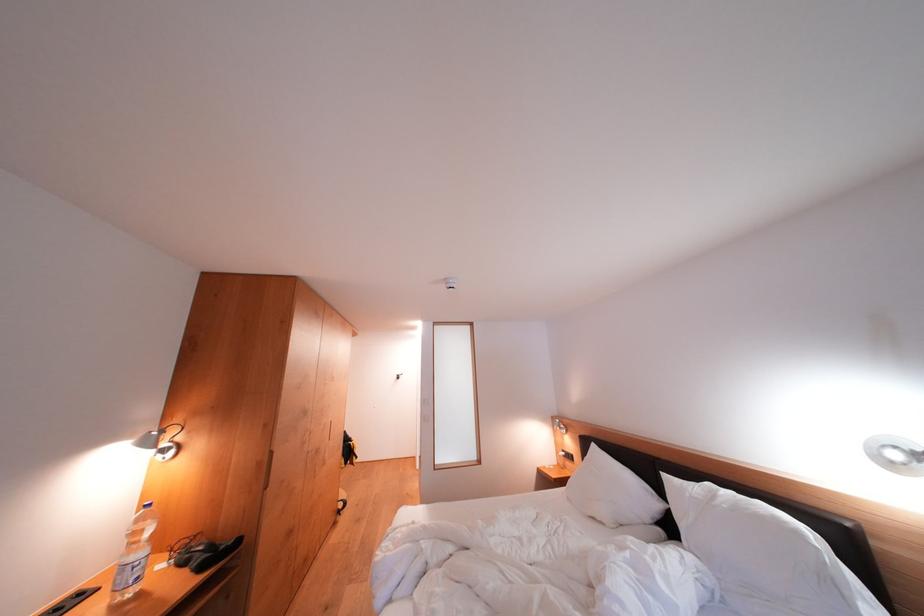
Where would you adjust the adjustable lamp head? Please return your answer as a coordinate pair (x, y).

(165, 453)